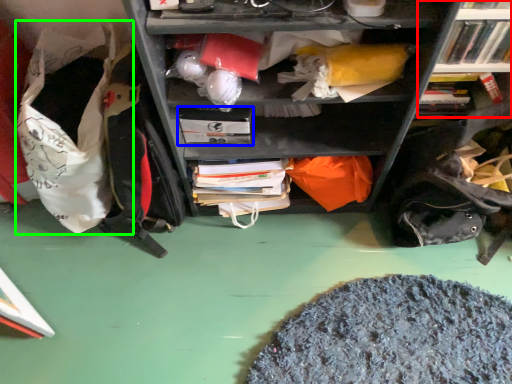
Question: Which is nearer to the bookcase (highlighted by a red box)? paperback book (highlighted by a blue box) or bean bag chair (highlighted by a green box).

Choices:
 (A) paperback book
 (B) bean bag chair

Answer: (A)